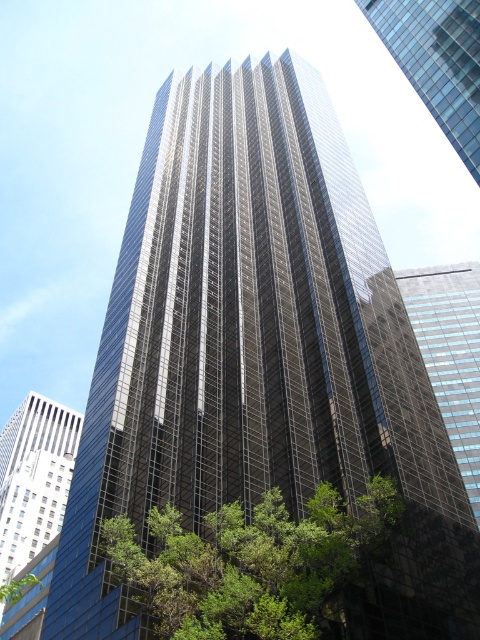
You are standing in a park and see the green leafy tree at center. The park has a rule that visitors must stay at least 100 feet away from any tree to protect their roots. Are you compliant with this rule?

The green leafy tree at center is 128.67 feet from viewer, which is more than the required 100 feet distance. Therefore, you are compliant with the park rule.

You are standing in front of the skyscraper and notice a point marked at coordinates (252, 563). What object is located at that point?

The point at (252, 563) indicates a green leafy tree at center.

You are standing in a park and see the green leafy tree at center and the glassy reflective skyscraper at upper right. Which object is wider from your perspective?

The green leafy tree at center is wider than the glassy reflective skyscraper at upper right from your perspective.